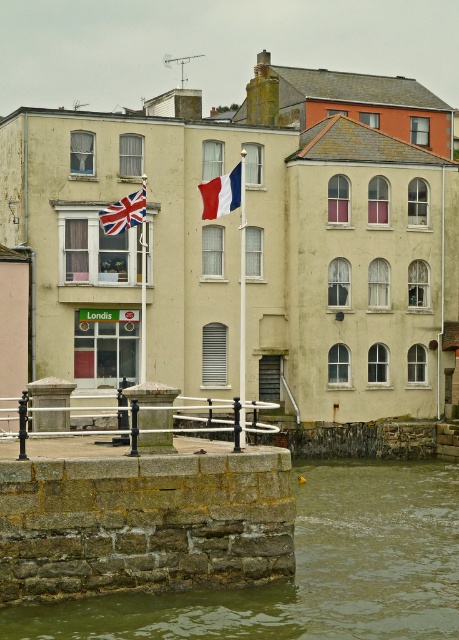
Question: Is brown stone wall at lower left bigger than smooth fabric flag at center?

Choices:
 (A) yes
 (B) no

Answer: (A)

Question: Which is farther from the smooth fabric flag at center?

Choices:
 (A) brown stone wall at lower left
 (B) smooth metal railing at center
 (C) union jack fabric flag at upper left

Answer: (A)

Question: Can you confirm if brown stone wall at lower left is positioned below smooth metal railing at center?

Choices:
 (A) no
 (B) yes

Answer: (B)

Question: Considering the relative positions of brown stone wall at lower left and smooth metal railing at center in the image provided, where is brown stone wall at lower left located with respect to smooth metal railing at center?

Choices:
 (A) below
 (B) above

Answer: (A)

Question: Which object appears farthest from the camera in this image?

Choices:
 (A) smooth metal railing at center
 (B) union jack fabric flag at upper left
 (C) brown stone wall at lower left

Answer: (B)

Question: Which object is positioned closest to the brown stone wall at lower left?

Choices:
 (A) smooth fabric flag at center
 (B) smooth metal railing at center

Answer: (B)